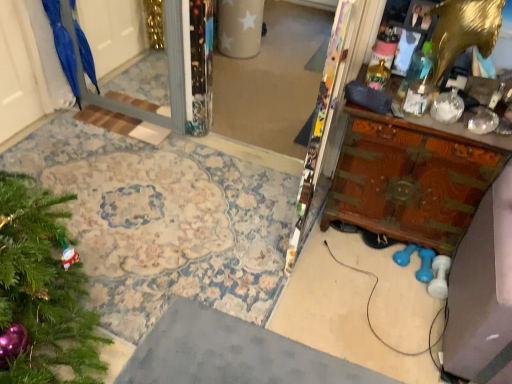
Question: Is blue matte umbrella at left taller than wooden carved vanity at right?

Choices:
 (A) yes
 (B) no

Answer: (B)

Question: From a real-world perspective, is blue matte umbrella at left below wooden carved vanity at right?

Choices:
 (A) yes
 (B) no

Answer: (B)

Question: Can you see blue matte umbrella at left touching wooden carved vanity at right?

Choices:
 (A) yes
 (B) no

Answer: (B)

Question: Is blue matte umbrella at left outside of wooden carved vanity at right?

Choices:
 (A) yes
 (B) no

Answer: (A)

Question: Does blue matte umbrella at left appear on the left side of wooden carved vanity at right?

Choices:
 (A) no
 (B) yes

Answer: (B)

Question: Can you confirm if blue matte umbrella at left is bigger than wooden carved vanity at right?

Choices:
 (A) no
 (B) yes

Answer: (A)

Question: Is wooden carved vanity at right directly adjacent to blue matte umbrella at left?

Choices:
 (A) no
 (B) yes

Answer: (A)

Question: Does wooden carved vanity at right contain blue matte umbrella at left?

Choices:
 (A) no
 (B) yes

Answer: (A)

Question: Considering the relative sizes of wooden carved vanity at right and blue matte umbrella at left in the image provided, is wooden carved vanity at right shorter than blue matte umbrella at left?

Choices:
 (A) no
 (B) yes

Answer: (A)

Question: Does wooden carved vanity at right have a greater width compared to blue matte umbrella at left?

Choices:
 (A) no
 (B) yes

Answer: (B)

Question: Is wooden carved vanity at right bigger than blue matte umbrella at left?

Choices:
 (A) yes
 (B) no

Answer: (A)

Question: Could you tell me if wooden carved vanity at right is facing blue matte umbrella at left?

Choices:
 (A) yes
 (B) no

Answer: (B)

Question: From the image's perspective, relative to blue matte umbrella at left, is wooden carved vanity at right above or below?

Choices:
 (A) above
 (B) below

Answer: (B)